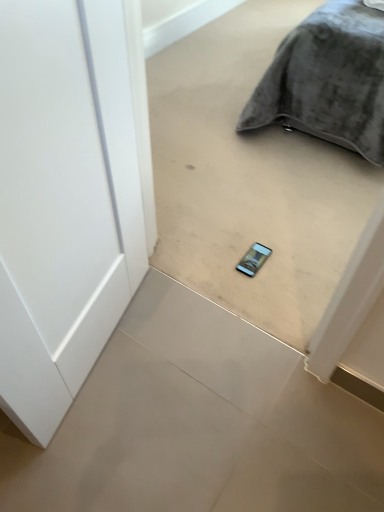
Question: From their relative heights in the image, would you say matte gray phone at center, acting as the second concrete starting from the bottom, is taller or shorter than white glossy concrete at center, placed as the first concrete when sorted from bottom to top?

Choices:
 (A) tall
 (B) short

Answer: (A)

Question: Is matte gray phone at center, acting as the second concrete starting from the bottom, wider or thinner than white glossy concrete at center, placed as the first concrete when sorted from bottom to top?

Choices:
 (A) wide
 (B) thin

Answer: (B)

Question: Which object is positioned farthest from the white glossy concrete at center, the second concrete positioned from the top?

Choices:
 (A) matte gray phone at center, acting as the second concrete starting from the bottom
 (B) velvet gray pillow at upper right

Answer: (B)

Question: Which object is positioned farthest from the velvet gray pillow at upper right?

Choices:
 (A) white glossy concrete at center, placed as the first concrete when sorted from bottom to top
 (B) matte gray phone at center, acting as the second concrete starting from the bottom

Answer: (A)